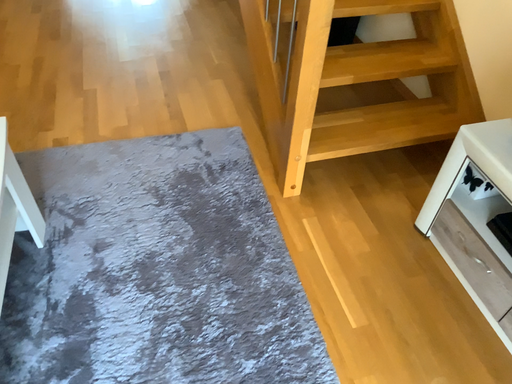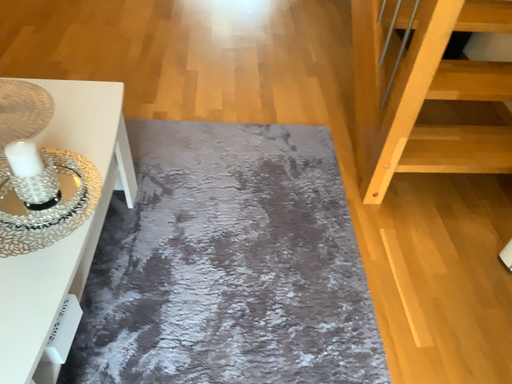
Question: How did the camera likely rotate when shooting the video?

Choices:
 (A) rotated left
 (B) rotated right

Answer: (A)